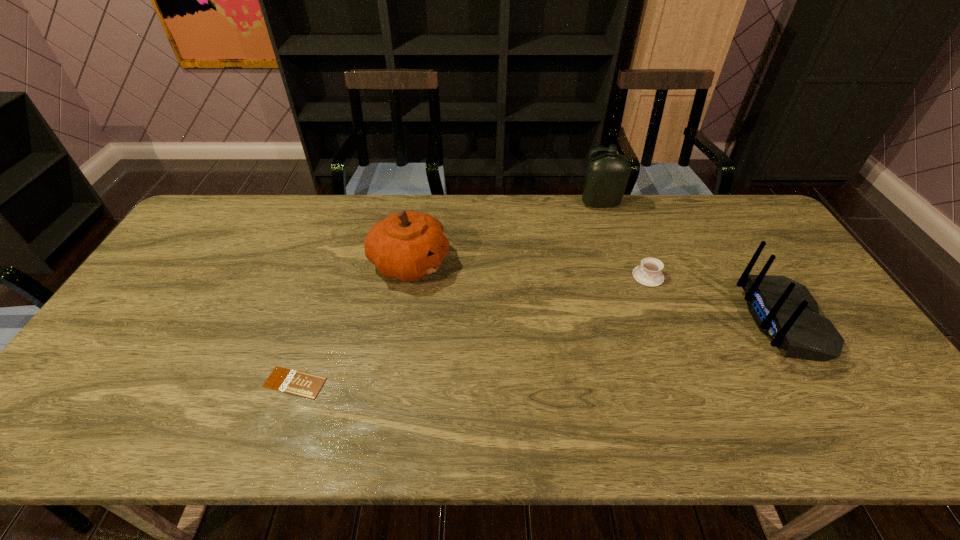
Locate an element on the screen. Image resolution: width=960 pixels, height=540 pixels. free point located on the back of the rightmost object is located at coordinates (700, 320).

Identify the location of free region located 0.170m on the handle side of the teacup. The height and width of the screenshot is (540, 960). (576, 276).

Identify the location of free space located on the handle side of the teacup. This screenshot has height=540, width=960. (522, 276).

In order to click on vacant space located 0.180m on the handle side of the teacup in this screenshot , I will do `click(572, 276)`.

At what (x,y) coordinates should I click in order to perform the action: click on free location located on the front of the shortest object. Please return your answer as a coordinate pair (x, y). The image size is (960, 540). Looking at the image, I should click on (277, 433).

Where is `bottle at the far edge`? bottle at the far edge is located at coordinates (606, 176).

Find the location of a particular element. Image resolution: width=960 pixels, height=540 pixels. pumpkin that is at the far edge is located at coordinates (408, 245).

This screenshot has width=960, height=540. Identify the location of object that is at the right edge. (784, 310).

At what (x,y) coordinates should I click in order to perform the action: click on vacant space at the far edge. Please return your answer as a coordinate pair (x, y). Looking at the image, I should click on [x=493, y=221].

Locate an element on the screen. This screenshot has width=960, height=540. vacant space at the near edge is located at coordinates (338, 439).